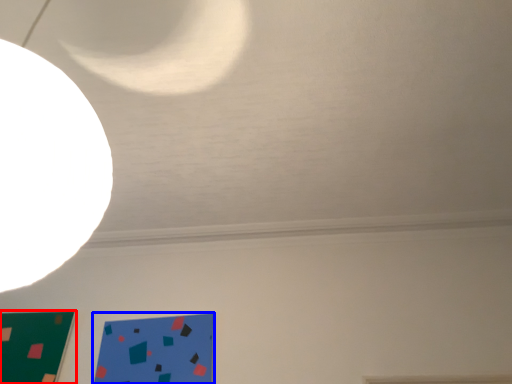
Question: Which object appears closest to the camera in this image, rectangle (highlighted by a red box) or design (highlighted by a blue box)?

Choices:
 (A) rectangle
 (B) design

Answer: (B)